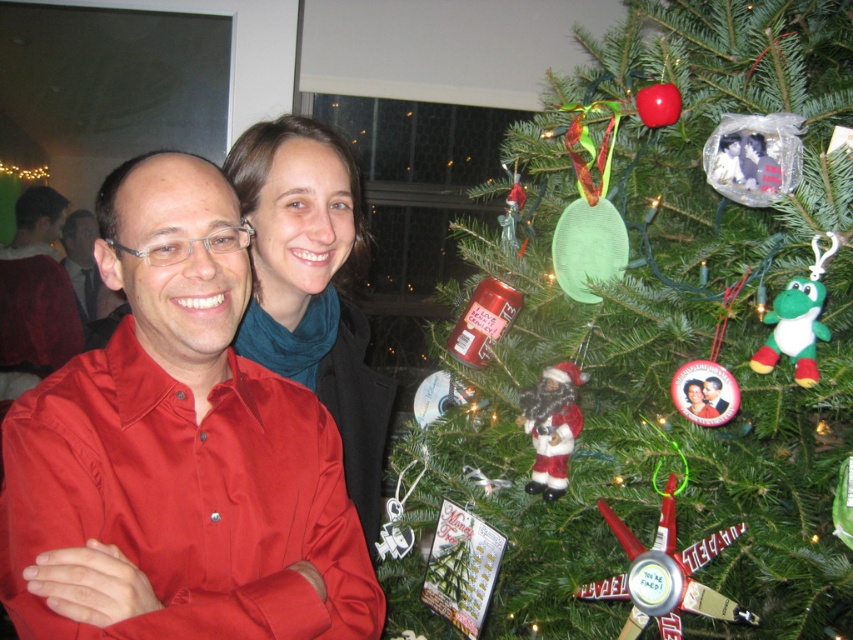
You are a photographer setting up for a Christmas photo shoot. You have a green matte christmas tree at center and a blue scarf at center in the scene. Which object should you focus on first if you want to capture the larger object in your shot?

The green matte christmas tree at center is bigger than the blue scarf at center, so you should focus on the green matte christmas tree at center first to capture the larger object.

You are taking a photo of the scene and want to focus on both the point at point (543, 344) and the point at point (177, 598). Which point should you focus on first to ensure both are in focus?

You should focus on point (543, 344) first because it is closer to the camera than point (177, 598), ensuring both points are within the depth of field.